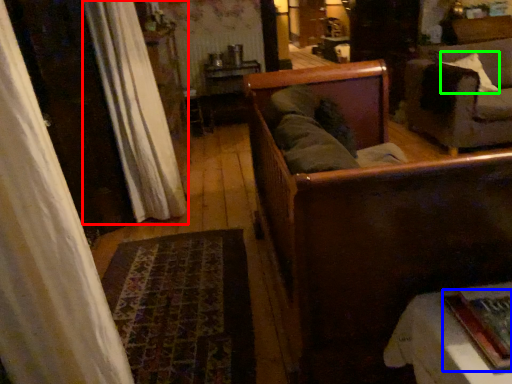
Question: Based on their relative distances, which object is farther from curtain (highlighted by a red box)? Choose from book (highlighted by a blue box) and pillow (highlighted by a green box).

Choices:
 (A) book
 (B) pillow

Answer: (B)